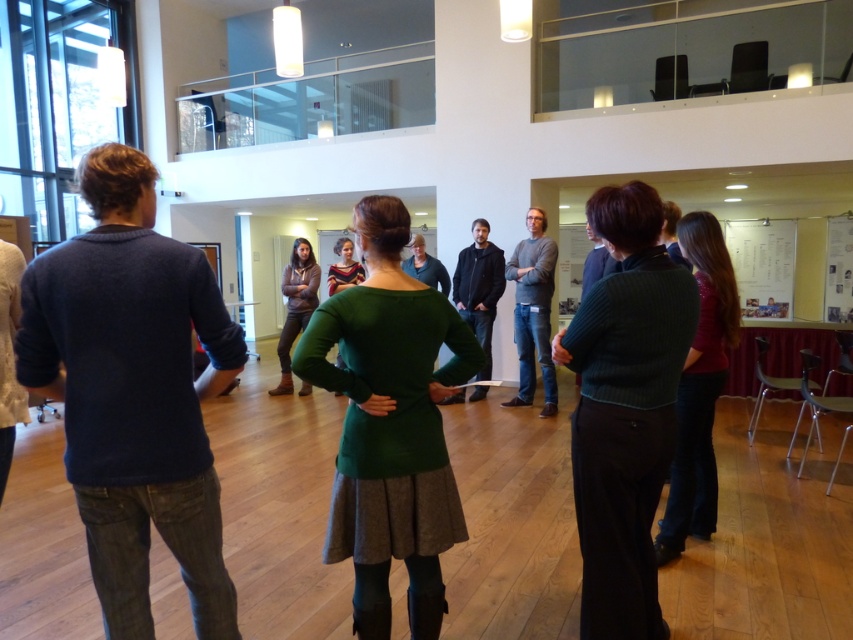
In the scene shown: You are a photographer trying to capture a photo of both the dark blue sweater at left and the gray sweater at center. Since you want both to be fully visible in the frame, which sweater should you focus on to ensure the other is in the background?

The dark blue sweater at left is not as tall as the gray sweater at center. Therefore, you should focus on the gray sweater at center to ensure the shorter dark blue sweater at left is in the background and fully visible.

You are standing at the entrance of the room and want to find the gray sweater at center. According to the coordinates provided, in which direction should you look to locate it?

The gray sweater at center is located at coordinates point [532,310]. Since the coordinate system starts from the bottom left corner, you should look towards the upper right direction to find it.